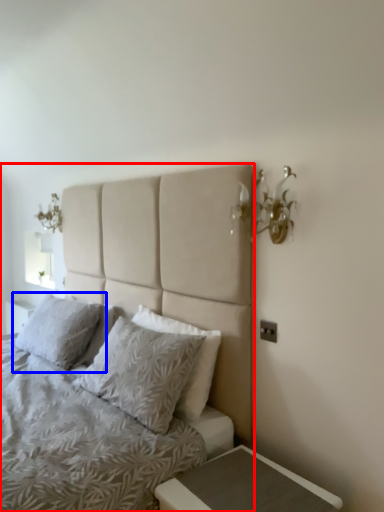
Question: Among these objects, which one is nearest to the camera, bed (highlighted by a red box) or pillow (highlighted by a blue box)?

Choices:
 (A) bed
 (B) pillow

Answer: (A)